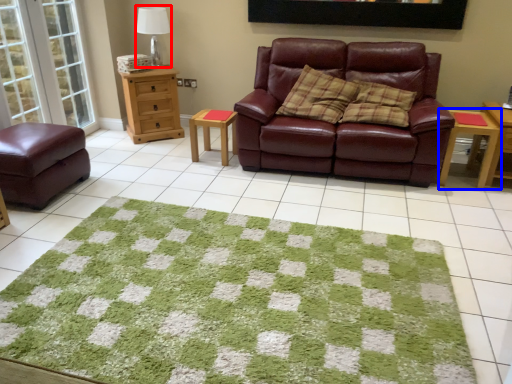
Question: Among these objects, which one is nearest to the camera, table lamp (highlighted by a red box) or table (highlighted by a blue box)?

Choices:
 (A) table lamp
 (B) table

Answer: (B)